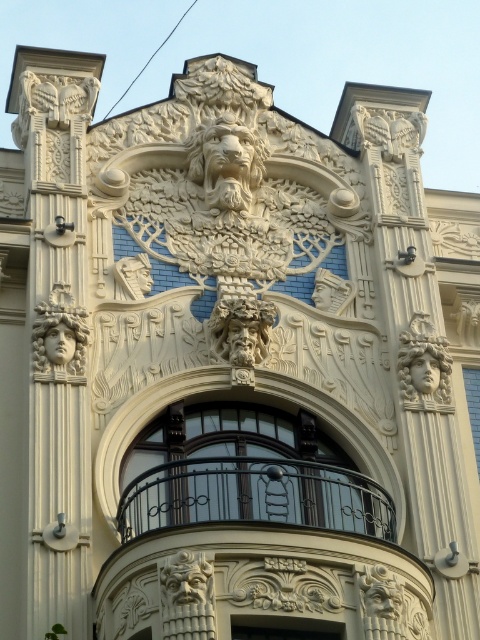
Can you confirm if white stone face at left is positioned above white stone lion head at center?

No, white stone face at left is not above white stone lion head at center.

Between white stone face at left and white stone lion head at center, which one appears on the left side from the viewer's perspective?

From the viewer's perspective, white stone face at left appears more on the left side.

Which is in front, point (34, 541) or point (192, 173)?

Positioned in front is point (34, 541).

At what (x,y) coordinates should I click in order to perform the action: click on white stone face at left. Please return your answer as a coordinate pair (x, y). The width and height of the screenshot is (480, 640). Looking at the image, I should click on (57, 348).

Is matte stone head at center below smooth wooden door at center?

No, matte stone head at center is not below smooth wooden door at center.

Looking at this image, is matte stone head at center smaller than smooth wooden door at center?

No.

Which is in front, point (218, 323) or point (245, 632)?

Point (245, 632) is more forward.

Identify the location of matte stone head at center. (240, 330).

Does matte stone head at center have a greater width compared to matte stone face at center?

Correct, the width of matte stone head at center exceeds that of matte stone face at center.

Can you confirm if matte stone head at center is positioned above matte stone face at center?

Correct, matte stone head at center is located above matte stone face at center.

The height and width of the screenshot is (640, 480). What do you see at coordinates (240, 330) in the screenshot?
I see `matte stone head at center` at bounding box center [240, 330].

Where is `matte stone head at center`? The height and width of the screenshot is (640, 480). matte stone head at center is located at coordinates (240, 330).